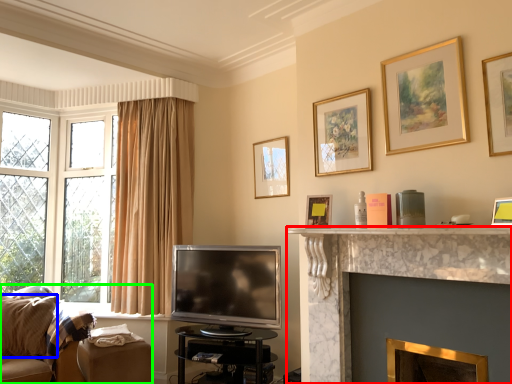
Question: Based on their relative distances, which object is farther from fireplace (highlighted by a red box)? Choose from pillow (highlighted by a blue box) and studio couch (highlighted by a green box).

Choices:
 (A) pillow
 (B) studio couch

Answer: (A)